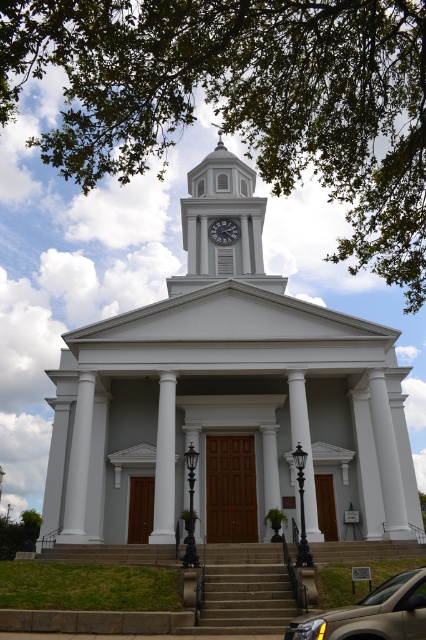
You are standing in front of the classical building and want to locate the white glossy clock tower at center. According to the building layout, where would you find it?

The white glossy clock tower at center is located at the point with coordinates 0.339 on the x axis and 0.523 on the y axis.

Looking at this image, you are standing in front of the classical building and want to enter through the main doors. Which object, the brown stone stairs at center or the matte gold suv at lower center, is closer to the entrance?

The brown stone stairs at center is closer to the entrance because it has a lesser height compared to the matte gold suv at lower center, indicating it is positioned nearer to the building.